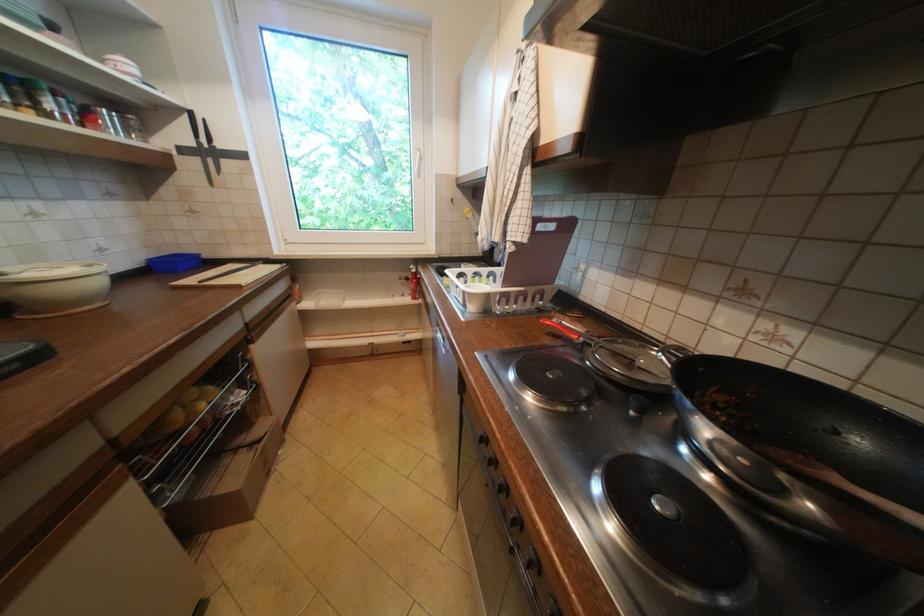
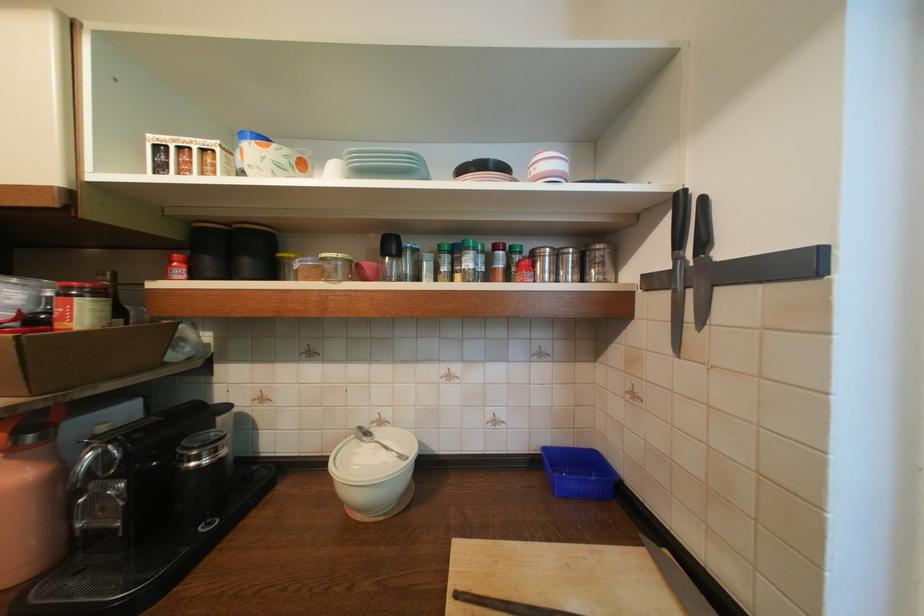
Where in the second image is the point corresponding to (x=118, y=116) from the first image?

(565, 256)